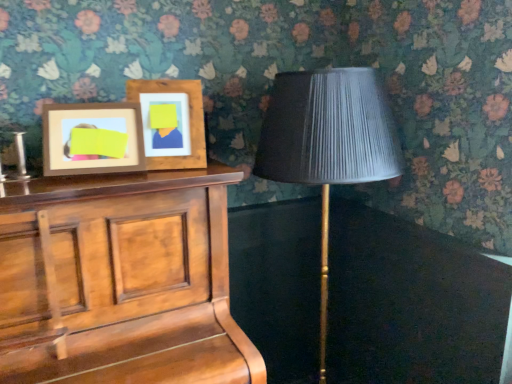
Question: Is wooden picture frame at upper left, the first picture frame positioned from the left, aimed at wooden picture frame at upper left, placed as the 1th picture frame when sorted from right to left?

Choices:
 (A) no
 (B) yes

Answer: (A)

Question: Would you say wooden picture frame at upper left, acting as the 2th picture frame starting from the right, is outside wooden picture frame at upper left, which ranks as the 2th picture frame in left-to-right order?

Choices:
 (A) yes
 (B) no

Answer: (A)

Question: Does wooden picture frame at upper left, the first picture frame positioned from the left, have a lesser width compared to wooden picture frame at upper left, placed as the 1th picture frame when sorted from right to left?

Choices:
 (A) yes
 (B) no

Answer: (A)

Question: Is wooden picture frame at upper left, acting as the 2th picture frame starting from the right, at the right side of wooden picture frame at upper left, which ranks as the 2th picture frame in left-to-right order?

Choices:
 (A) no
 (B) yes

Answer: (A)

Question: From a real-world perspective, is wooden picture frame at upper left, acting as the 2th picture frame starting from the right, located higher than wooden picture frame at upper left, which ranks as the 2th picture frame in left-to-right order?

Choices:
 (A) yes
 (B) no

Answer: (B)

Question: From the image's perspective, relative to matte black lampshade at right, is wooden piano at left above or below?

Choices:
 (A) above
 (B) below

Answer: (B)

Question: Looking at the image, does wooden piano at left seem bigger or smaller compared to matte black lampshade at right?

Choices:
 (A) small
 (B) big

Answer: (B)

Question: Based on their positions, is wooden piano at left located to the left or right of matte black lampshade at right?

Choices:
 (A) right
 (B) left

Answer: (B)

Question: Considering the positions of wooden piano at left and matte black lampshade at right in the image, is wooden piano at left wider or thinner than matte black lampshade at right?

Choices:
 (A) wide
 (B) thin

Answer: (A)

Question: From the image's perspective, is wooden piano at left located above or below wooden picture frame at upper left, which ranks as the 2th picture frame in left-to-right order?

Choices:
 (A) above
 (B) below

Answer: (B)

Question: From a real-world perspective, relative to wooden picture frame at upper left, which ranks as the 2th picture frame in left-to-right order, is wooden piano at left vertically above or below?

Choices:
 (A) above
 (B) below

Answer: (B)

Question: Is wooden piano at left spatially inside wooden picture frame at upper left, placed as the 1th picture frame when sorted from right to left, or outside of it?

Choices:
 (A) inside
 (B) outside

Answer: (B)

Question: Is point (209, 306) closer or farther from the camera than point (153, 87)?

Choices:
 (A) farther
 (B) closer

Answer: (A)

Question: Considering their positions, is wooden picture frame at upper left, which ranks as the 2th picture frame in left-to-right order, located in front of or behind matte black lampshade at right?

Choices:
 (A) front
 (B) behind

Answer: (B)

Question: From the image's perspective, is wooden picture frame at upper left, which ranks as the 2th picture frame in left-to-right order, located above or below matte black lampshade at right?

Choices:
 (A) above
 (B) below

Answer: (A)